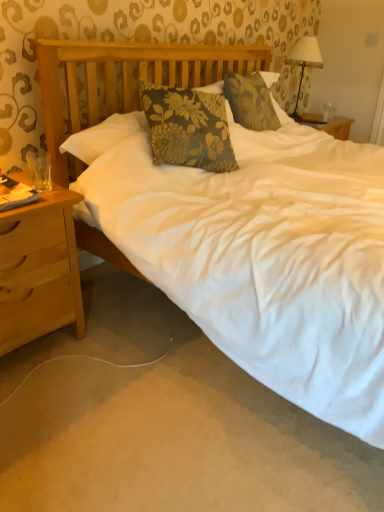
Question: From the image's perspective, is light brown wood nightstand at left located above or below transparent glass at upper right?

Choices:
 (A) above
 (B) below

Answer: (B)

Question: Is light brown wood nightstand at left spatially inside transparent glass at upper right, or outside of it?

Choices:
 (A) outside
 (B) inside

Answer: (A)

Question: Which is farther from the transparent glass at upper right?

Choices:
 (A) white fabric lampshade at upper right
 (B) light brown wood nightstand at left

Answer: (B)

Question: Which of these objects is positioned farthest from the light brown wood nightstand at left?

Choices:
 (A) white fabric lampshade at upper right
 (B) transparent glass at upper right

Answer: (B)